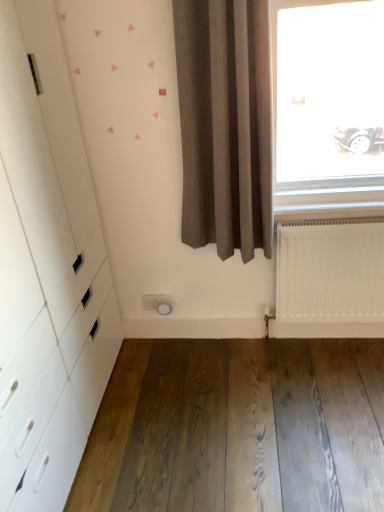
This screenshot has width=384, height=512. Identify the location of blank space situated above white matte radiator at lower right (from a real-world perspective). (329, 220).